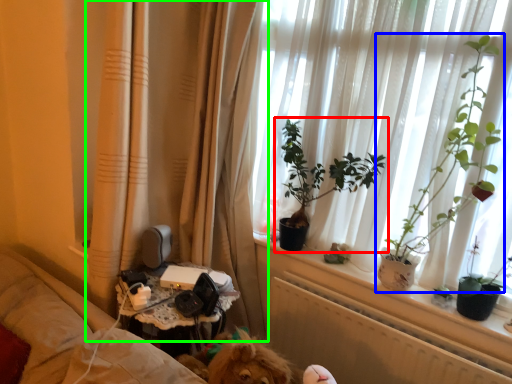
Question: Which object is the closest to the houseplant (highlighted by a red box)? Choose among these: houseplant (highlighted by a blue box) or curtain (highlighted by a green box).

Choices:
 (A) houseplant
 (B) curtain

Answer: (B)